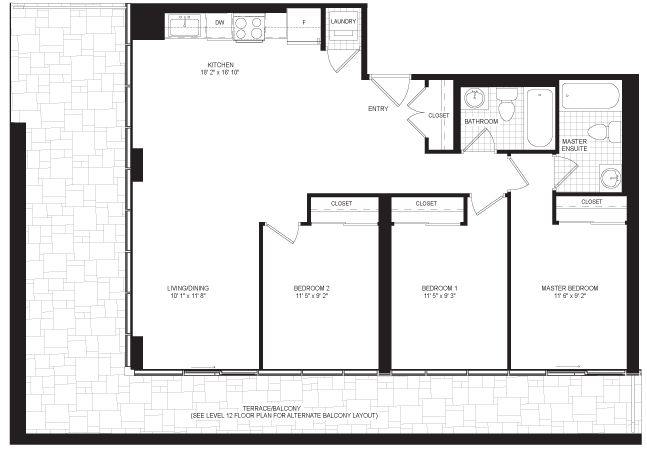
Identify the location of closets. (353, 214), (432, 215), (444, 112), (593, 210).